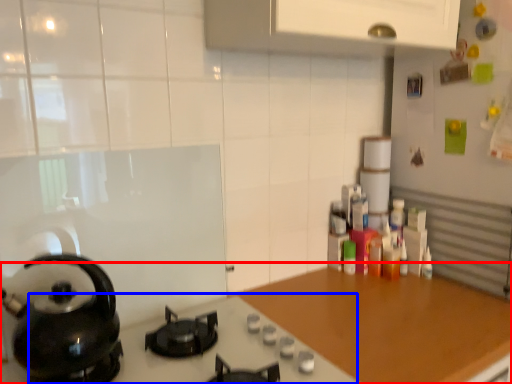
Question: Which point is closer to the camera, countertop (highlighted by a red box) or gas stove (highlighted by a blue box)?

Choices:
 (A) countertop
 (B) gas stove

Answer: (B)